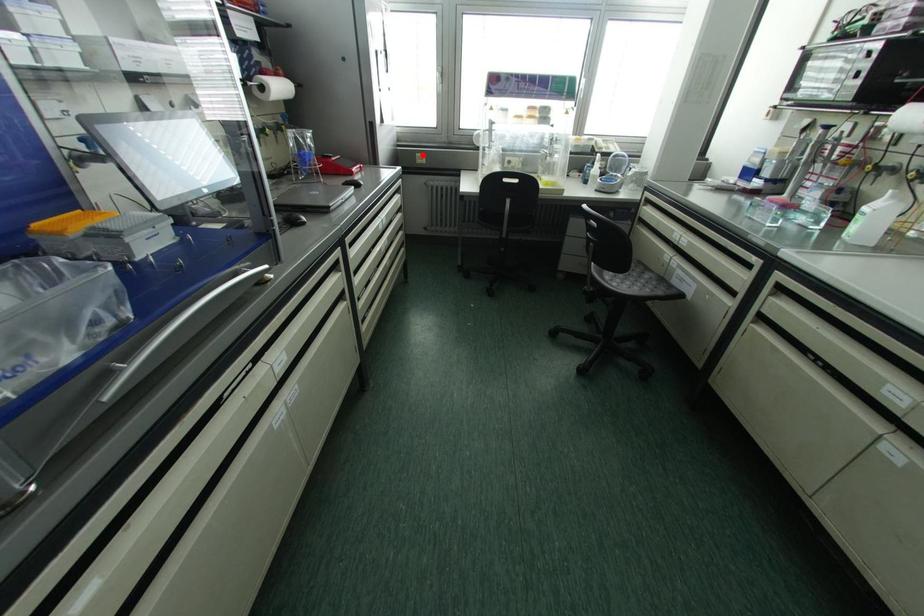
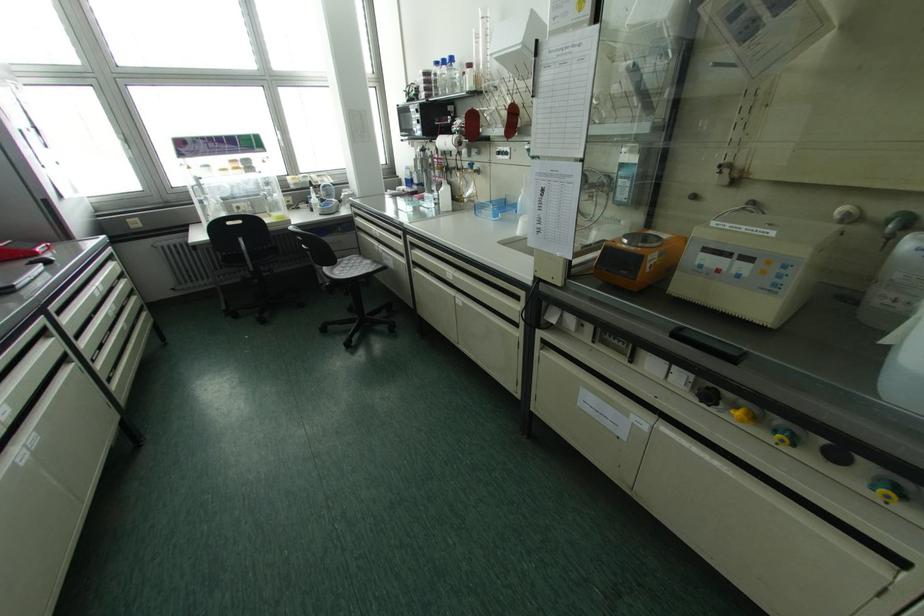
Question: I am providing you with two images of the same scene from different viewpoints. Given a red point in image1, look at the same physical point in image2. Is it:

Choices:
 (A) Closer to the viewpoint
 (B) Farther from the viewpoint

Answer: (B)